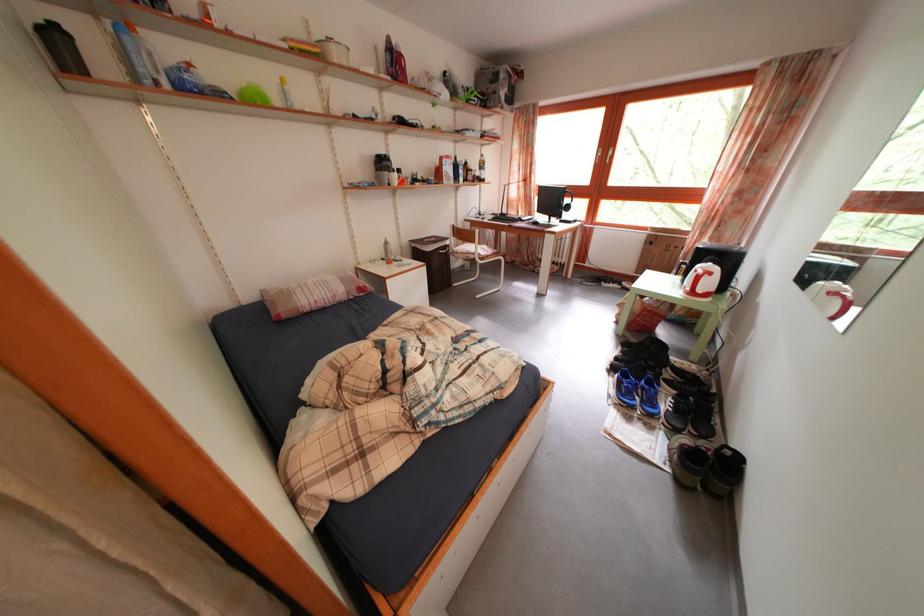
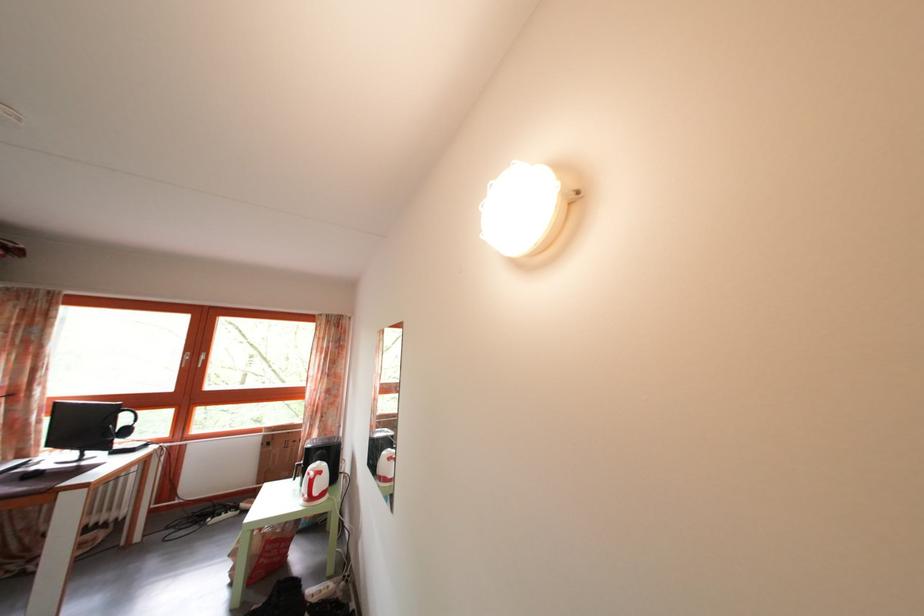
Where in the second image is the point corresponding to point (572, 223) from the first image?

(128, 451)